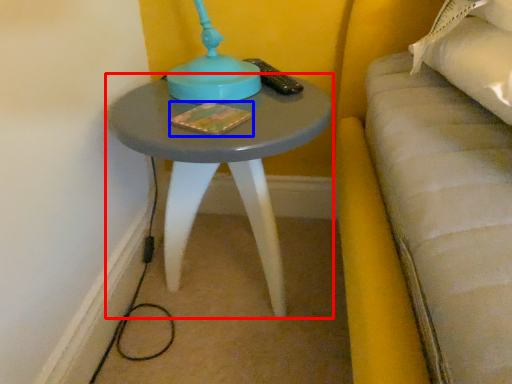
Question: Which object appears closest to the camera in this image, table (highlighted by a red box) or book (highlighted by a blue box)?

Choices:
 (A) table
 (B) book

Answer: (A)